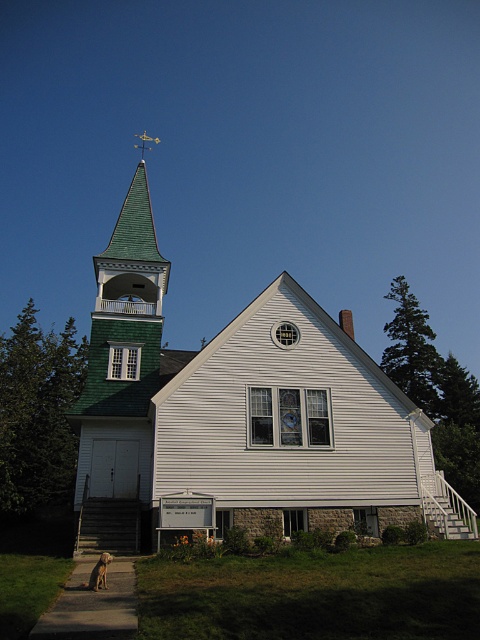
You are standing in front of the church and want to locate the white wood church steeple at upper left. Based on the coordinate system where the bottom left corner is the origin, can you determine its position?

The white wood church steeple at upper left is located at coordinate point 0.653 in the x axis and 0.500 in the y axis.